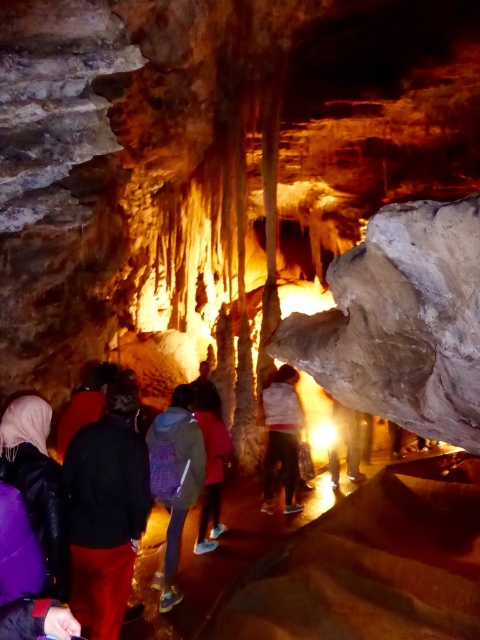
Does dark gray fabric backpack at center have a greater height compared to dark brown leather jacket at lower left?

Yes, dark gray fabric backpack at center is taller than dark brown leather jacket at lower left.

Is point (206, 420) positioned in front of point (59, 454)?

Yes, point (206, 420) is in front of point (59, 454).

At what (x,y) coordinates should I click in order to perform the action: click on dark gray fabric backpack at center. Please return your answer as a coordinate pair (x, y). Looking at the image, I should click on (211, 460).

Is purple leather jacket at lower left bigger than dark gray fabric backpack at center?

Actually, purple leather jacket at lower left might be smaller than dark gray fabric backpack at center.

Who is lower down, purple leather jacket at lower left or dark gray fabric backpack at center?

Positioned lower is dark gray fabric backpack at center.

Is point (54, 512) positioned after point (203, 390)?

No, (54, 512) is closer to viewer.

You are a GUI agent. You are given a task and a screenshot of the screen. Output one action in this format:
    pyautogui.click(x=<x>, y=<y>)
    Task: Click on the purple leather jacket at lower left
    
    Given the screenshot: What is the action you would take?
    [x=36, y=483]

Based on the photo, can you confirm if purple leather jacket at lower left is taller than purple fabric backpack at center?

No, purple leather jacket at lower left is not taller than purple fabric backpack at center.

Does purple leather jacket at lower left appear on the left side of purple fabric backpack at center?

Correct, you'll find purple leather jacket at lower left to the left of purple fabric backpack at center.

Which is behind, point (36, 401) or point (166, 484)?

The point (166, 484) is more distant.

I want to click on purple leather jacket at lower left, so click(36, 483).